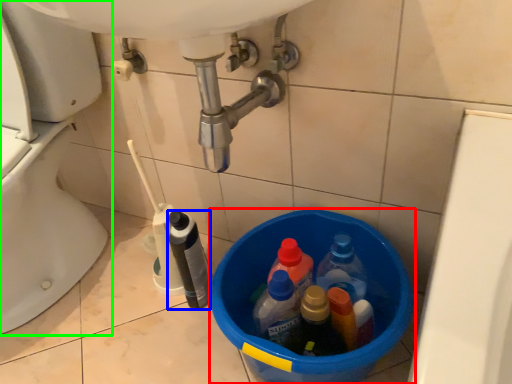
Question: Which object is the closest to the basin (highlighted by a red box)? Choose among these: bottle (highlighted by a blue box) or toilet (highlighted by a green box).

Choices:
 (A) bottle
 (B) toilet

Answer: (A)